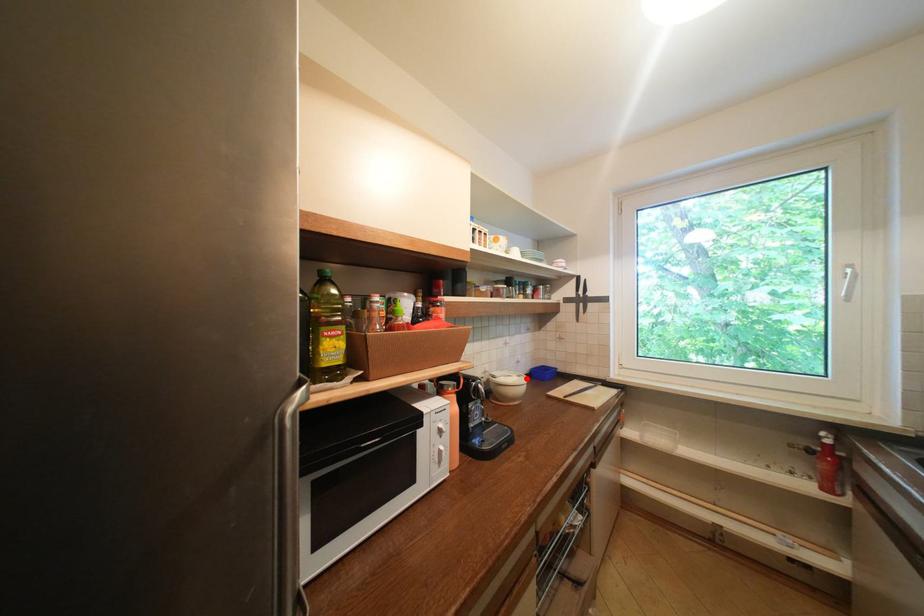
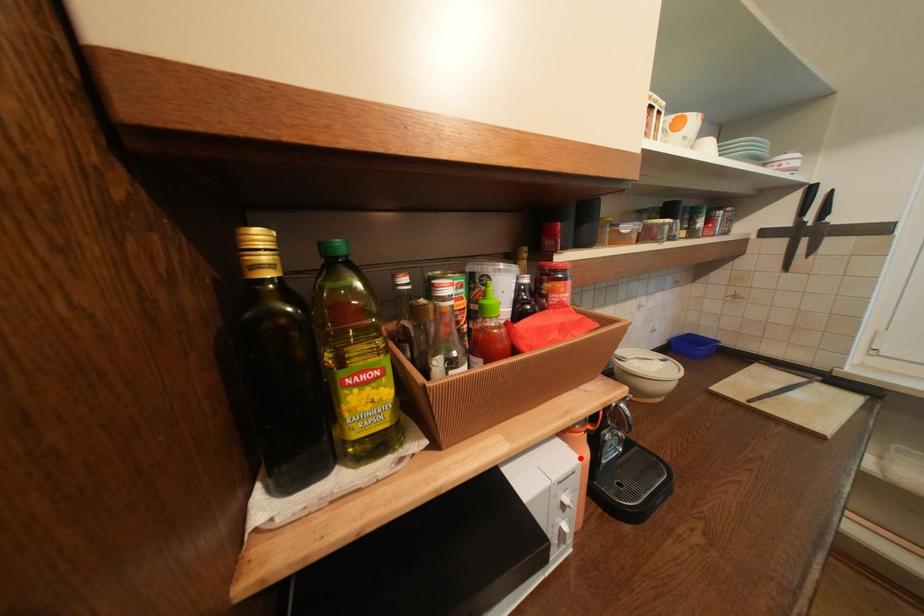
Looking at this image, I am providing you with two images of the same scene from different viewpoints. A red point is marked on the first image and another point is marked on the second image. Is the marked point in image1 the same physical position as the marked point in image2?

No